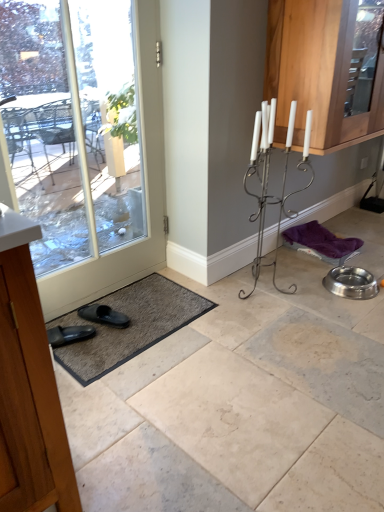
The width and height of the screenshot is (384, 512). Describe the element at coordinates (317, 71) in the screenshot. I see `wooden cabinet at upper right, positioned as the 1th cabinetry in top-to-bottom order` at that location.

Where is `wooden cabinet at left, arranged as the 2th cabinetry when viewed from the right`? The width and height of the screenshot is (384, 512). wooden cabinet at left, arranged as the 2th cabinetry when viewed from the right is located at coordinates (29, 382).

Locate an element on the screen. The image size is (384, 512). gray textured bath mat at lower left is located at coordinates click(x=133, y=326).

The height and width of the screenshot is (512, 384). What do you see at coordinates (104, 315) in the screenshot?
I see `black rubber slipper at lower left` at bounding box center [104, 315].

This screenshot has height=512, width=384. I want to click on wooden cabinet at upper right, the second cabinetry viewed from the left, so click(x=317, y=71).

From a real-world perspective, is clear glass door at lower left under wooden cabinet at upper right, acting as the first cabinetry starting from the right?

Correct, in the physical world, clear glass door at lower left is lower than wooden cabinet at upper right, acting as the first cabinetry starting from the right.

From the image's perspective, between clear glass door at lower left and wooden cabinet at upper right, acting as the first cabinetry starting from the right, which one is located above?

wooden cabinet at upper right, acting as the first cabinetry starting from the right, from the image's perspective.

Does clear glass door at lower left have a lesser height compared to wooden cabinet at upper right, the second cabinetry viewed from the left?

No, clear glass door at lower left is not shorter than wooden cabinet at upper right, the second cabinetry viewed from the left.

Does clear glass door at lower left turn towards wooden cabinet at upper right, acting as the first cabinetry starting from the right?

No, clear glass door at lower left is not facing towards wooden cabinet at upper right, acting as the first cabinetry starting from the right.

From the image's perspective, is metallic silver candle holder at center right under wooden cabinet at upper right, acting as the first cabinetry starting from the right?

Yes.

In terms of height, does metallic silver candle holder at center right look taller or shorter compared to wooden cabinet at upper right, acting as the 1th cabinetry starting from the back?

In the image, metallic silver candle holder at center right appears to be taller than wooden cabinet at upper right, acting as the 1th cabinetry starting from the back.

What are the coordinates of `cabinetry on the right of the metallic silver candle holder at center right` in the screenshot? It's located at (317, 71).

Is metallic silver candle holder at center right turned away from wooden cabinet at upper right, the second cabinetry positioned from the bottom?

No, metallic silver candle holder at center right is not facing away from wooden cabinet at upper right, the second cabinetry positioned from the bottom.

Choose the correct answer: Is wooden cabinet at upper right, positioned as the 1th cabinetry in top-to-bottom order, inside black rubber slipper at lower left or outside it?

wooden cabinet at upper right, positioned as the 1th cabinetry in top-to-bottom order, is spatially situated outside black rubber slipper at lower left.

In the scene shown: From the image's perspective, is wooden cabinet at upper right, the second cabinetry when ordered from front to back, located above or below black rubber slipper at lower left?

From the image's perspective, wooden cabinet at upper right, the second cabinetry when ordered from front to back, appears above black rubber slipper at lower left.

Is wooden cabinet at upper right, the second cabinetry positioned from the bottom, aimed at black rubber slipper at lower left?

No, wooden cabinet at upper right, the second cabinetry positioned from the bottom, is not oriented towards black rubber slipper at lower left.

Is wooden cabinet at upper right, positioned as the 1th cabinetry in top-to-bottom order, not close to black rubber slipper at lower left?

That's right, there is a large distance between wooden cabinet at upper right, positioned as the 1th cabinetry in top-to-bottom order, and black rubber slipper at lower left.

Could you tell me if metallic silver candle holder at center right is turned towards black rubber slipper at lower left?

No, metallic silver candle holder at center right is not aimed at black rubber slipper at lower left.

Is point (257, 213) positioned after point (124, 317)?

Yes, it is.

Does metallic silver candle holder at center right have a greater width compared to black rubber slipper at lower left?

Yes.

From the image's perspective, does metallic silver candle holder at center right appear lower than black rubber slipper at lower left?

No.

From a real-world perspective, which object stands above the other?

wooden cabinet at upper right, the second cabinetry when ordered from front to back.

Which object is more forward, wooden cabinet at upper right, positioned as the 1th cabinetry in top-to-bottom order, or metallic silver candle holder at center right?

metallic silver candle holder at center right is more forward.

Which object is positioned more to the right, wooden cabinet at upper right, acting as the first cabinetry starting from the right, or metallic silver candle holder at center right?

wooden cabinet at upper right, acting as the first cabinetry starting from the right.

Is wooden cabinet at upper right, acting as the first cabinetry starting from the right, positioned in front of clear glass door at lower left?

No, wooden cabinet at upper right, acting as the first cabinetry starting from the right, is further to the viewer.

Locate an element on the screen. The image size is (384, 512). cabinetry above the clear glass door at lower left (from the image's perspective) is located at coordinates (317, 71).

In terms of height, does wooden cabinet at upper right, acting as the 1th cabinetry starting from the back, look taller or shorter compared to clear glass door at lower left?

Clearly, wooden cabinet at upper right, acting as the 1th cabinetry starting from the back, is shorter compared to clear glass door at lower left.

Considering the sizes of objects metallic silver candle holder at center right and wooden cabinet at left, the 1th cabinetry viewed from the left, in the image provided, who is thinner, metallic silver candle holder at center right or wooden cabinet at left, the 1th cabinetry viewed from the left,?

With smaller width is metallic silver candle holder at center right.

Which is in front, point (271, 138) or point (70, 459)?

The point (70, 459) is closer to the camera.

From the image's perspective, which is below, metallic silver candle holder at center right or wooden cabinet at left, which appears as the second cabinetry when viewed from the top?

wooden cabinet at left, which appears as the second cabinetry when viewed from the top, appears lower in the image.

Considering the relative sizes of metallic silver candle holder at center right and wooden cabinet at left, the 1th cabinetry viewed from the left, in the image provided, is metallic silver candle holder at center right smaller than wooden cabinet at left, the 1th cabinetry viewed from the left,?

No, metallic silver candle holder at center right is not smaller than wooden cabinet at left, the 1th cabinetry viewed from the left.

What are the coordinates of `door located below the wooden cabinet at upper right, the second cabinetry viewed from the left (from the image's perspective)` in the screenshot? It's located at (145, 193).

This screenshot has height=512, width=384. There is a metallic silver candle holder at center right. Find the location of `cabinetry above it (from a real-world perspective)`. cabinetry above it (from a real-world perspective) is located at coordinates (317, 71).

Which object lies further to the anchor point gray textured bath mat at lower left, metallic silver candle holder at center right or clear glass door at lower left?

Among the two, metallic silver candle holder at center right is located further to gray textured bath mat at lower left.

From the image, which object appears to be nearer to clear glass door at lower left, gray textured bath mat at lower left or metallic silver candle holder at center right?

gray textured bath mat at lower left.

From the image, which object appears to be farther from wooden cabinet at upper right, acting as the first cabinetry starting from the right, wooden cabinet at left, placed as the second cabinetry when sorted from back to front, or black rubber slipper at lower left?

The object further to wooden cabinet at upper right, acting as the first cabinetry starting from the right, is wooden cabinet at left, placed as the second cabinetry when sorted from back to front.

From the image, which object appears to be nearer to metallic silver candle holder at center right, black rubber slipper at lower left or gray textured bath mat at lower left?

Among the two, gray textured bath mat at lower left is located nearer to metallic silver candle holder at center right.

Considering their positions, is gray textured bath mat at lower left positioned further to wooden cabinet at upper right, the second cabinetry viewed from the left, than metallic silver candle holder at center right?

gray textured bath mat at lower left.

Based on their spatial positions, is black rubber slipper at lower left or metallic silver candle holder at center right closer to gray textured bath mat at lower left?

black rubber slipper at lower left lies closer to gray textured bath mat at lower left than the other object.

Considering their positions, is metallic silver candle holder at center right positioned closer to black rubber slipper at lower left than gray textured bath mat at lower left?

gray textured bath mat at lower left is closer to black rubber slipper at lower left.

Looking at the image, which one is located closer to gray textured bath mat at lower left, metallic silver candle holder at center right or wooden cabinet at left, which appears as the second cabinetry when viewed from the top?

metallic silver candle holder at center right.

At what (x,y) coordinates should I click in order to perform the action: click on footwear between wooden cabinet at upper right, acting as the 1th cabinetry starting from the back, and gray textured bath mat at lower left from top to bottom. Please return your answer as a coordinate pair (x, y). Looking at the image, I should click on (104, 315).

Where is `footwear situated between wooden cabinet at left, arranged as the 2th cabinetry when viewed from the right, and wooden cabinet at upper right, the second cabinetry when ordered from front to back, from left to right`? The height and width of the screenshot is (512, 384). footwear situated between wooden cabinet at left, arranged as the 2th cabinetry when viewed from the right, and wooden cabinet at upper right, the second cabinetry when ordered from front to back, from left to right is located at coordinates (104, 315).

This screenshot has height=512, width=384. Identify the location of candle holder that lies between wooden cabinet at upper right, the second cabinetry when ordered from front to back, and gray textured bath mat at lower left from top to bottom. (267, 179).

Locate an element on the screen. The height and width of the screenshot is (512, 384). bath mat between black rubber slipper at lower left and metallic silver candle holder at center right is located at coordinates (133, 326).